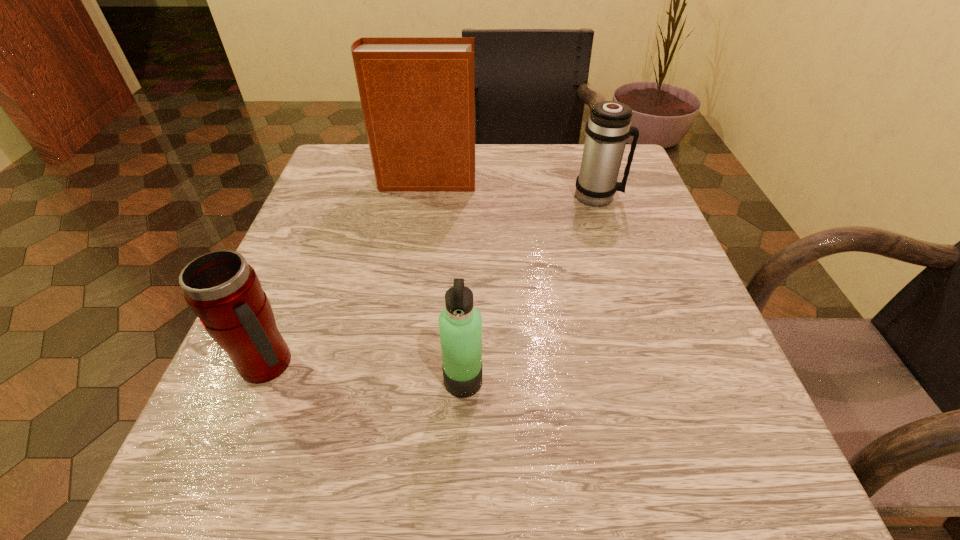
Where is `hardback book located in the left edge section of the desktop`? hardback book located in the left edge section of the desktop is located at coordinates (417, 94).

Where is `thermos bottle that is at the left edge`? The height and width of the screenshot is (540, 960). thermos bottle that is at the left edge is located at coordinates (224, 291).

You are a GUI agent. You are given a task and a screenshot of the screen. Output one action in this format:
    pyautogui.click(x=<x>, y=<y>)
    Task: Click on the object that is at the right edge
    The height and width of the screenshot is (540, 960).
    Given the screenshot: What is the action you would take?
    pyautogui.click(x=608, y=128)

This screenshot has height=540, width=960. Identify the location of object at the far left corner. (417, 94).

Locate an element on the screen. object located at the far right corner is located at coordinates (608, 128).

This screenshot has height=540, width=960. In order to click on free region at the far edge of the desktop in this screenshot , I will do `click(521, 181)`.

Locate an element on the screen. free space at the near edge of the desktop is located at coordinates (523, 480).

Locate an element on the screen. vacant space at the left edge of the desktop is located at coordinates (288, 288).

The image size is (960, 540). What are the coordinates of `vacant space at the right edge of the desktop` in the screenshot? It's located at (639, 269).

Find the location of `vacant area at the far left corner`. vacant area at the far left corner is located at coordinates (349, 163).